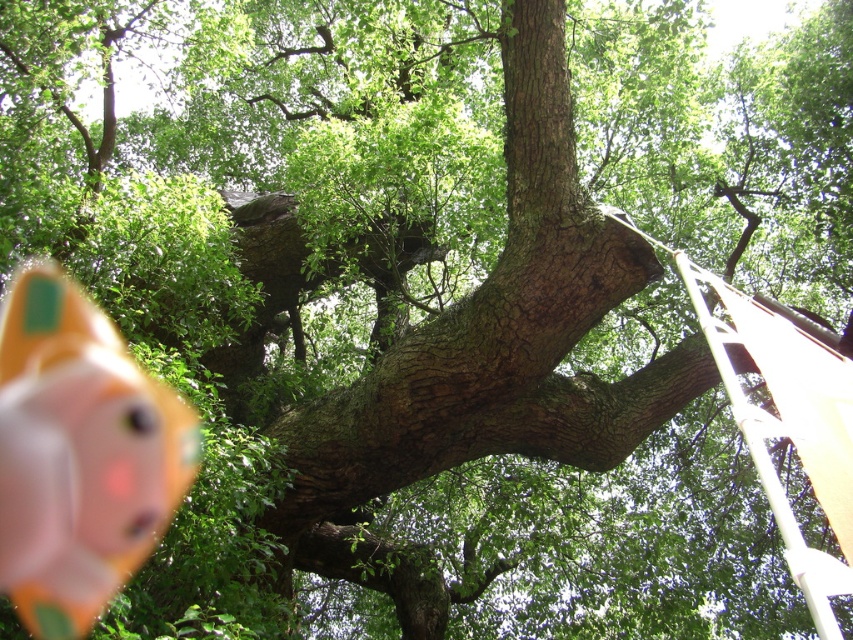
You are a child visiting the park and you see the pink rubber duck at lower left and the white plastic ladder at right. Which object is taller?

The pink rubber duck at lower left is much taller than the white plastic ladder at right.

You are a child who found a pink rubber duck at lower left near the base of the large tree. You want to place it exactly at the point marked by coordinates point (79, 454). Is the pink rubber duck at lower left already at the correct location?

Yes, the pink rubber duck at lower left is already at the point marked by coordinates point (79, 454) as stated in the description.